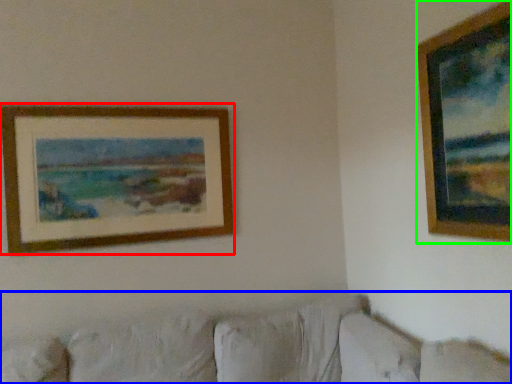
Question: Which object is positioned closest to picture frame (highlighted by a red box)? Select from couch (highlighted by a blue box) and picture frame (highlighted by a green box).

Choices:
 (A) couch
 (B) picture frame

Answer: (A)